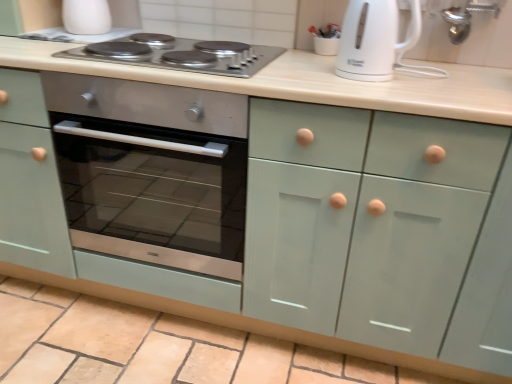
Where is `free space in front of white glossy cup at upper left`? The height and width of the screenshot is (384, 512). free space in front of white glossy cup at upper left is located at coordinates (73, 42).